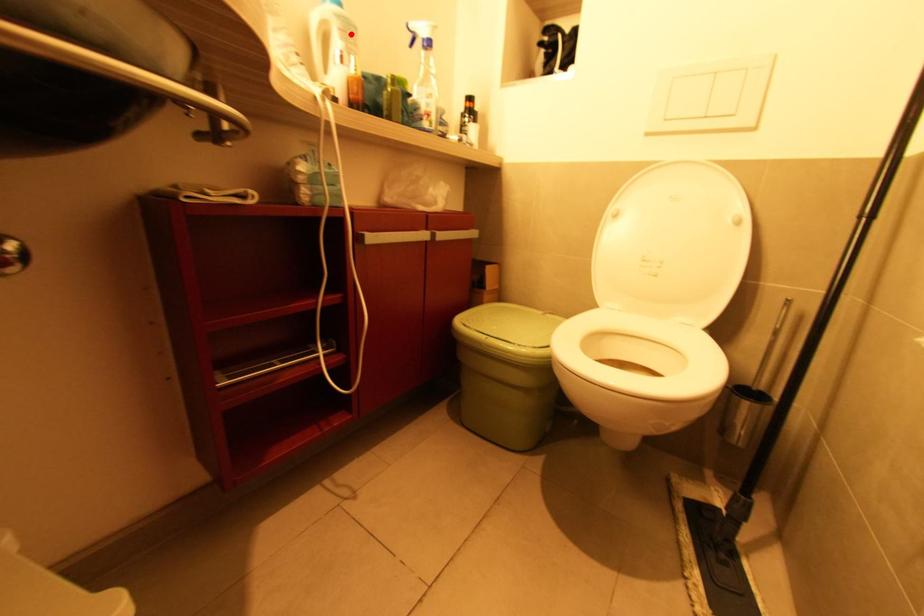
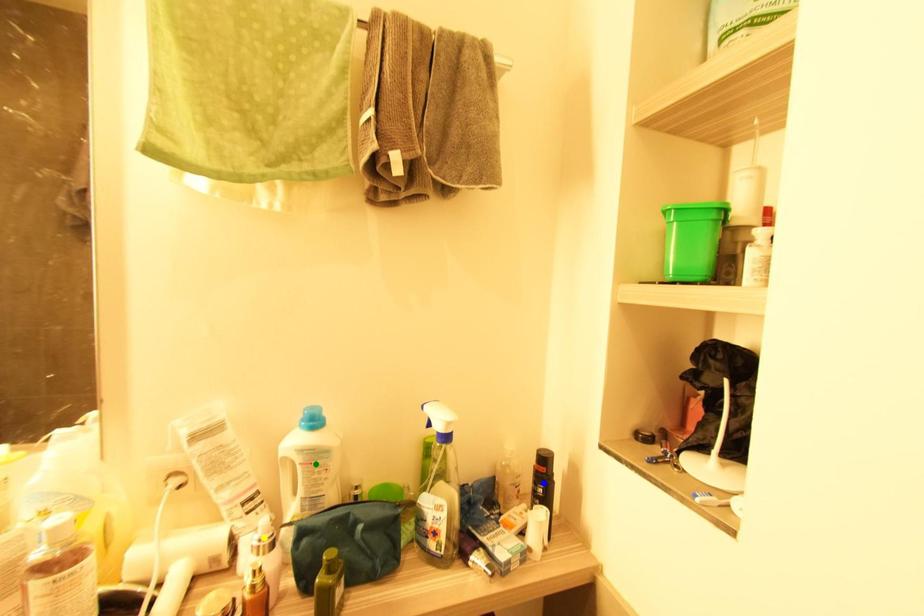
Question: I am providing you with two images of the same scene from different viewpoints. A red point is marked on the first image. You are given multiple points on the second image. Which mark in image 2 goes with the point in image 1?

Choices:
 (A) yellow point
 (B) green point
 (C) blue point

Answer: (B)